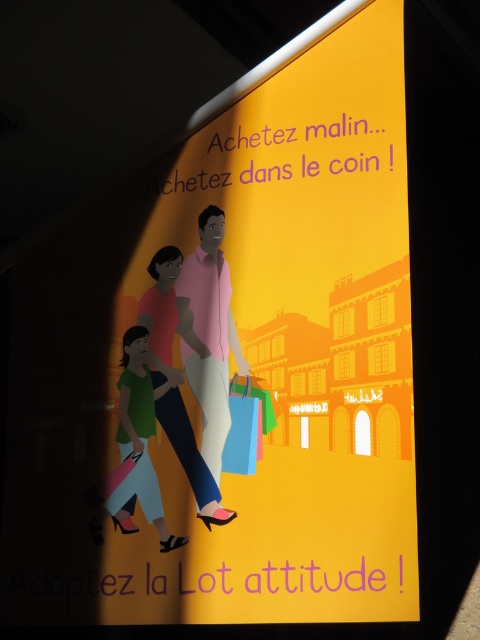
Which is behind, point (168, 330) or point (136, 486)?

Point (168, 330)

Measure the distance from matte pink dress at center to matte green fabric at lower left.

matte pink dress at center and matte green fabric at lower left are 5.88 inches apart.

Does point (168, 438) come behind point (155, 429)?

No, (168, 438) is in front of (155, 429).

Locate an element on the screen. matte pink dress at center is located at coordinates (176, 381).

Who is more distant from viewer, (175, 392) or (237, 378)?

Positioned behind is point (175, 392).

Who is more distant from viewer, [212,477] or [238,380]?

Point [238,380]

This screenshot has height=640, width=480. Identify the location of matte pink dress at center. (176, 381).

Does matte green fabric at lower left appear over green fabric shopping bag at center?

Actually, matte green fabric at lower left is below green fabric shopping bag at center.

Who is shorter, matte green fabric at lower left or green fabric shopping bag at center?

green fabric shopping bag at center

Is point (127, 380) closer to camera compared to point (249, 376)?

No.

The image size is (480, 640). In order to click on matte green fabric at lower left in this screenshot , I will do `click(139, 436)`.